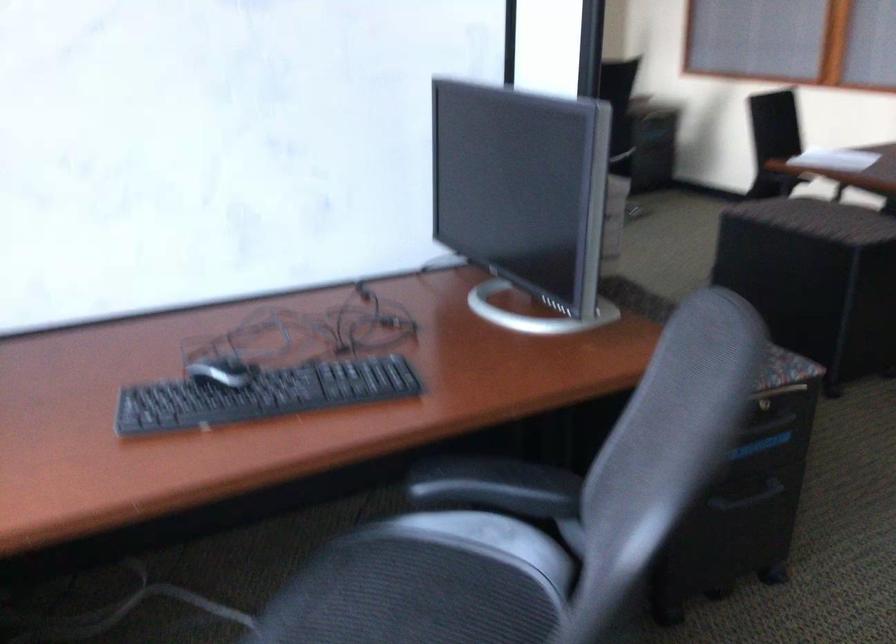
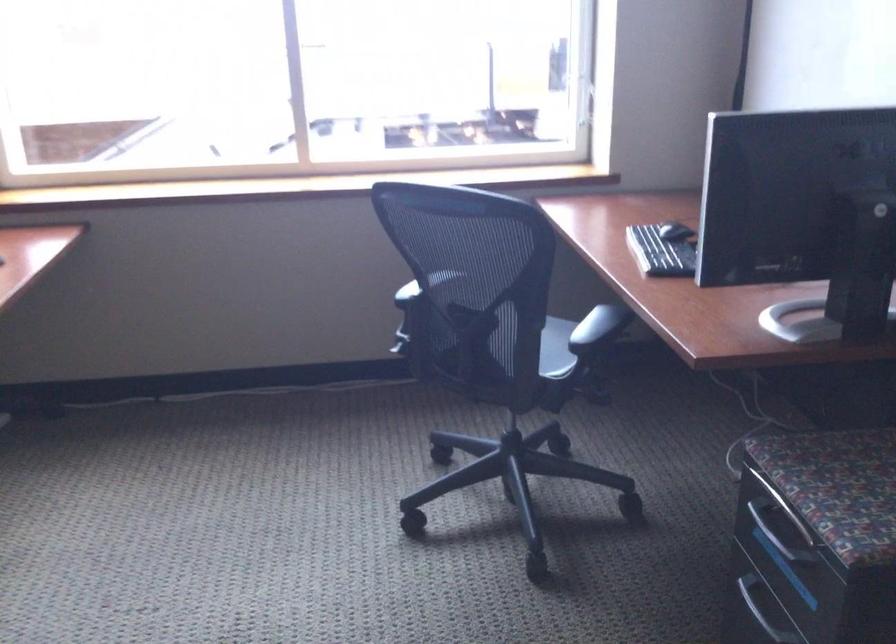
In the second image, find the point that corresponds to point 767,496 in the first image.

(755, 614)